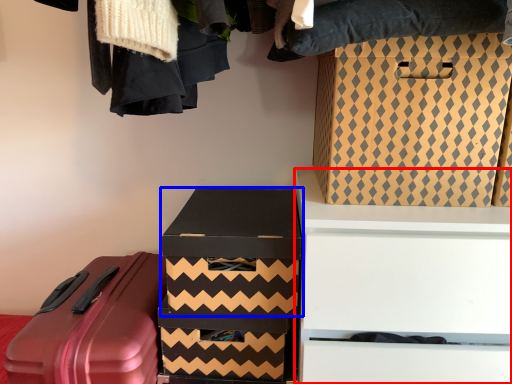
Question: Which object is closer to the camera taking this photo, furniture (highlighted by a red box) or box (highlighted by a blue box)?

Choices:
 (A) furniture
 (B) box

Answer: (A)